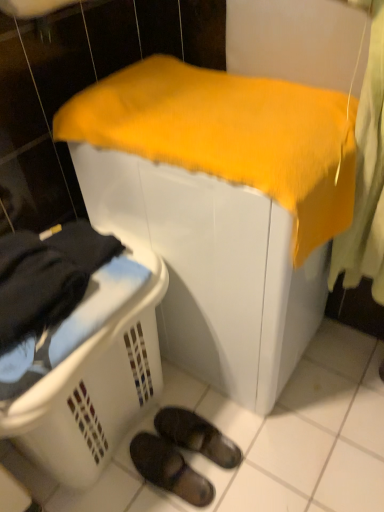
Find the location of `vacant space that is to the left of black rubber slippers at lower center, the first footwear when ordered from bottom to top`. vacant space that is to the left of black rubber slippers at lower center, the first footwear when ordered from bottom to top is located at coordinates tap(114, 485).